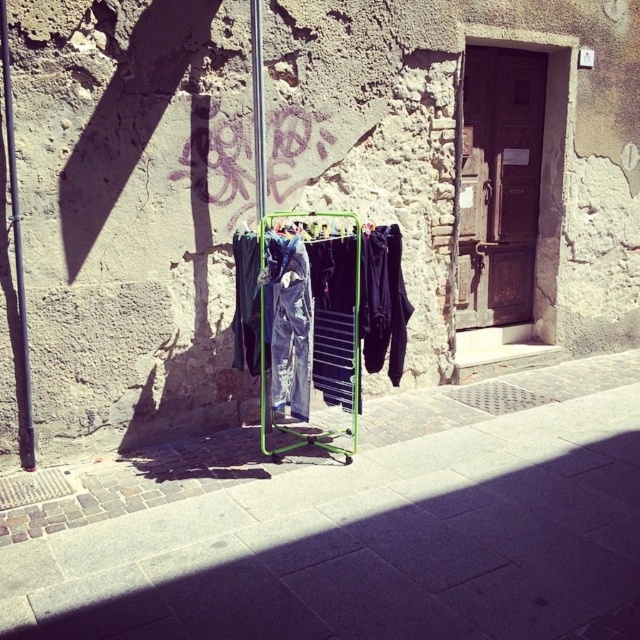
You are a delivery person trying to place a small package on the smooth concrete pavement at center. However, there are denim jeans at center in the way. Can you place the package on the pavement without moving the jeans?

The smooth concrete pavement at center is not as tall as denim jeans at center, meaning the jeans are taller. Since the jeans are taller, they are likely hanging or placed above the pavement. Therefore, you can place the package on the pavement beneath the jeans without moving them.

You are standing in the outdoor scene and want to walk from the denim pants at center to the smooth concrete pavement at center. Which direction should you face to move directly towards your destination?

You should face to the right to move directly from the denim pants at center to the smooth concrete pavement at center since the smooth concrete pavement at center is located to the right of the denim pants at center.

You are standing on the smooth concrete pavement at center and want to place a large potted plant. Where should you position it so it doesn not block the path? Please provide coordinates based on the image grid system.

The smooth concrete pavement at center is located at point (365, 544), so you should position the potted plant away from this coordinate to avoid blocking the path.